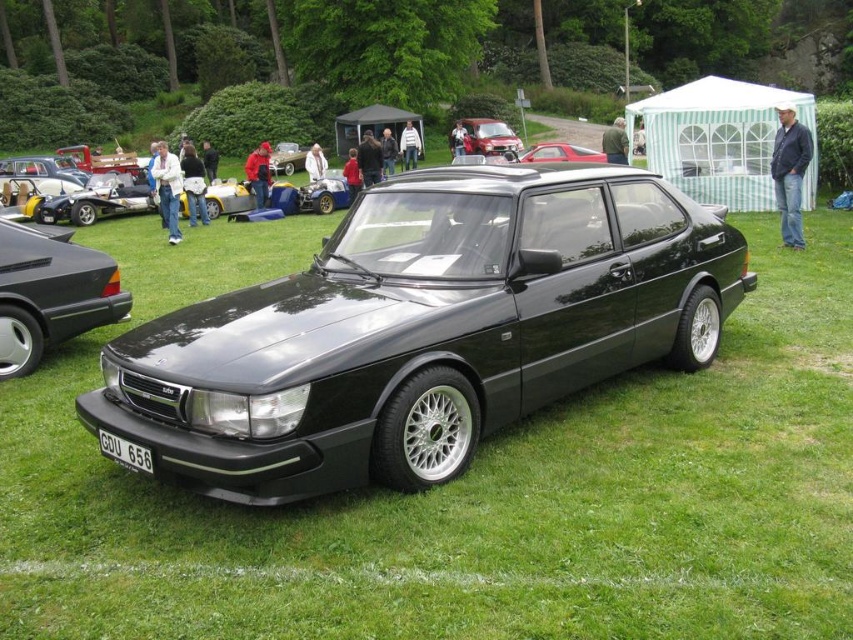
Question: Which object is farther from the camera taking this photo?

Choices:
 (A) matte black sedan at center
 (B) metallic red car at center
 (C) matte black car at center
 (D) black metallic car at center

Answer: (B)

Question: In this image, where is black metallic car at center located relative to metallic red car at center?

Choices:
 (A) above
 (B) below

Answer: (B)

Question: Does white plastic license plate at center lie in front of matte black car at center?

Choices:
 (A) no
 (B) yes

Answer: (B)

Question: Estimate the real-world distances between objects in this image. Which object is closer to the metallic red car at center?

Choices:
 (A) matte black sedan at center
 (B) matte black car at center
 (C) white plastic license plate at center

Answer: (B)

Question: Is white plastic license plate at center behind matte black car at center?

Choices:
 (A) yes
 (B) no

Answer: (B)

Question: Among these objects, which one is nearest to the camera?

Choices:
 (A) black metallic car at center
 (B) white plastic license plate at center

Answer: (A)